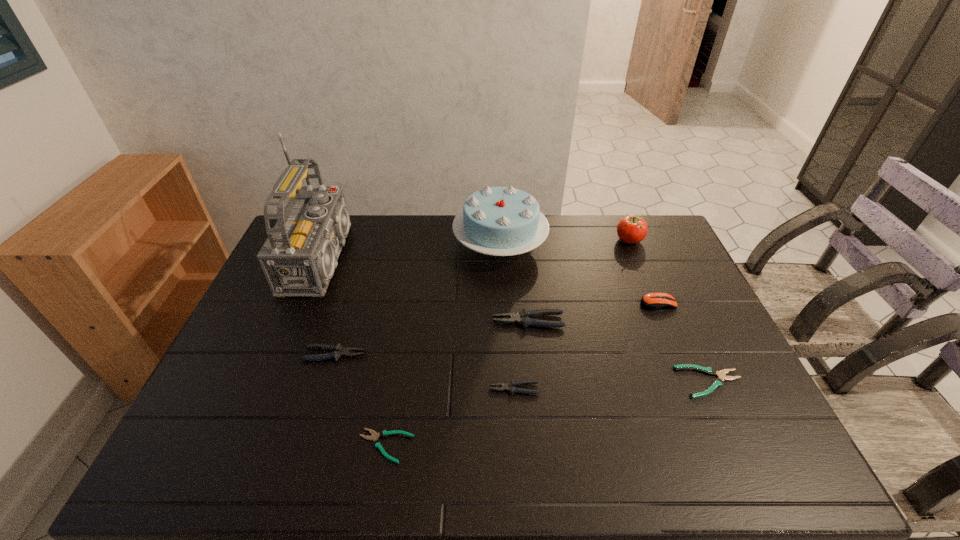
At what (x,y) coordinates should I click in order to perform the action: click on gray radio receiver. Please return your answer as a coordinate pair (x, y). The image size is (960, 540). Looking at the image, I should click on (299, 257).

Identify the location of radio receiver. (299, 257).

This screenshot has height=540, width=960. I want to click on the eighth shortest object, so click(x=501, y=221).

Image resolution: width=960 pixels, height=540 pixels. In order to click on blue birthday cake in this screenshot , I will do `click(501, 221)`.

Image resolution: width=960 pixels, height=540 pixels. Find the location of `red tomato`. red tomato is located at coordinates (631, 229).

Where is `the seventh shortest object`? the seventh shortest object is located at coordinates point(631,229).

Where is `the sixth shortest object`? The width and height of the screenshot is (960, 540). the sixth shortest object is located at coordinates (652, 301).

Image resolution: width=960 pixels, height=540 pixels. Find the location of `orange computer mouse`. orange computer mouse is located at coordinates (652, 301).

Find the location of a particular element. The height and width of the screenshot is (540, 960). the tallest pliers is located at coordinates (524, 317).

You are a GUI agent. You are given a task and a screenshot of the screen. Output one action in this format:
    pyautogui.click(x=<x>, y=<y>)
    Task: Click on the fifth farthest object
    
    Given the screenshot: What is the action you would take?
    [524, 317]